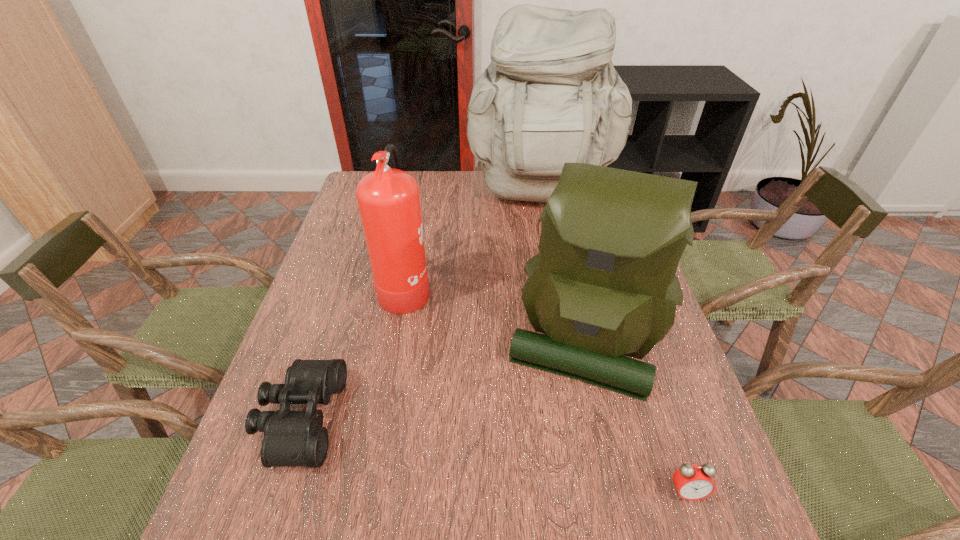
This screenshot has width=960, height=540. What are the coordinates of `free spot between the shorter backpack and the leftmost object` in the screenshot? It's located at (442, 379).

Image resolution: width=960 pixels, height=540 pixels. Find the location of `free space between the nearer backpack and the alarm clock`. free space between the nearer backpack and the alarm clock is located at coordinates (635, 415).

You are a GUI agent. You are given a task and a screenshot of the screen. Output one action in this format:
    pyautogui.click(x=<x>, y=<y>)
    Task: Click on the vacant region between the binoculars and the nearer backpack
    
    Given the screenshot: What is the action you would take?
    pyautogui.click(x=442, y=379)

The image size is (960, 540). Find the location of `free space between the alarm clock and the fire extinguisher`. free space between the alarm clock and the fire extinguisher is located at coordinates (546, 389).

Where is `free space between the tallest object and the fire extinguisher`? free space between the tallest object and the fire extinguisher is located at coordinates pyautogui.click(x=472, y=241).

Where is `free spot between the leftmost object and the shorter backpack`? Image resolution: width=960 pixels, height=540 pixels. free spot between the leftmost object and the shorter backpack is located at coordinates (442, 379).

Find the location of a particular element. The width and height of the screenshot is (960, 540). vacant space that is in between the leftmost object and the nearest object is located at coordinates (493, 455).

The image size is (960, 540). In order to click on object that is the fourth closest to the farthest object in this screenshot , I will do `click(693, 482)`.

The image size is (960, 540). Find the location of `object that is the third nearest to the farther backpack`. object that is the third nearest to the farther backpack is located at coordinates (291, 438).

You are a GUI agent. You are given a task and a screenshot of the screen. Output one action in this format:
    pyautogui.click(x=<x>, y=<y>)
    Task: Click on the free space that satisfies the following two spatial constraints: 1. on the front-facing side of the farther backpack; 2. at the eyepieces of the binoculars
    This screenshot has width=960, height=540.
    Given the screenshot: What is the action you would take?
    pyautogui.click(x=581, y=418)